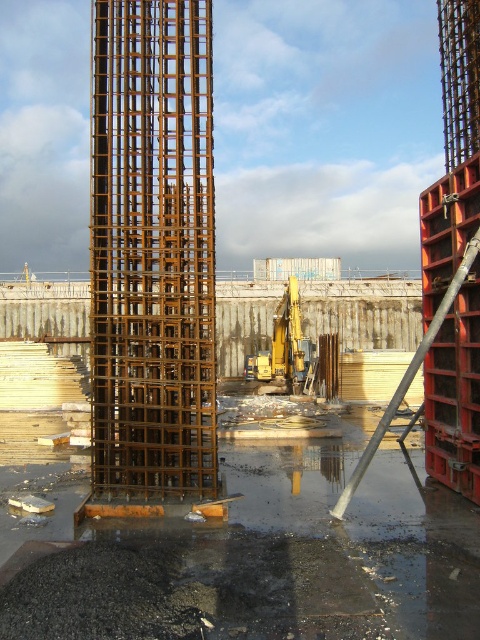
Does rusty metal tower at left appear over yellow metallic excavator at center?

Indeed, rusty metal tower at left is positioned over yellow metallic excavator at center.

Can you confirm if rusty metal tower at left is positioned to the right of yellow metallic excavator at center?

In fact, rusty metal tower at left is to the left of yellow metallic excavator at center.

This screenshot has height=640, width=480. In order to click on rusty metal tower at left in this screenshot , I will do `click(153, 250)`.

Locate an element on the screen. The width and height of the screenshot is (480, 640). rusty metal tower at left is located at coordinates (153, 250).